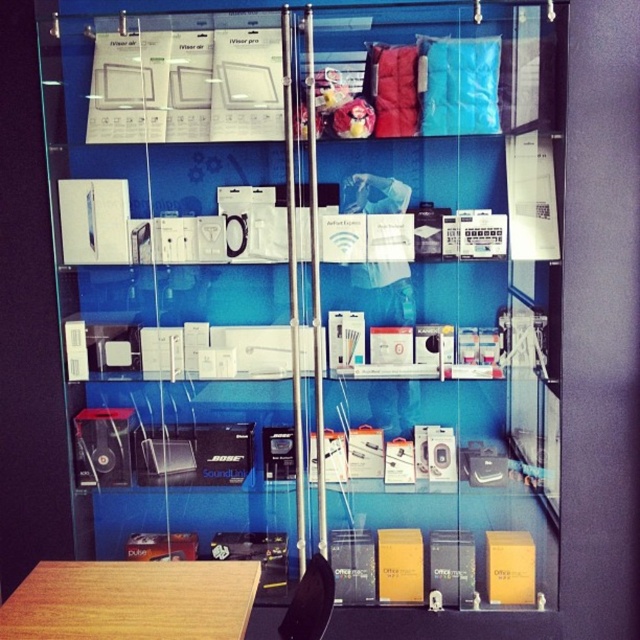
Question: Which of the following is the closest to the observer?

Choices:
 (A) wooden table at lower left
 (B) transparent plastic glass door at upper center

Answer: (A)

Question: Among these objects, which one is nearest to the camera?

Choices:
 (A) transparent plastic glass door at upper center
 (B) wooden table at lower left

Answer: (B)

Question: Does transparent plastic glass door at upper center have a larger size compared to wooden table at lower left?

Choices:
 (A) no
 (B) yes

Answer: (B)

Question: Is transparent plastic glass door at upper center below wooden table at lower left?

Choices:
 (A) no
 (B) yes

Answer: (A)

Question: Where is transparent plastic glass door at upper center located in relation to wooden table at lower left in the image?

Choices:
 (A) above
 (B) below

Answer: (A)